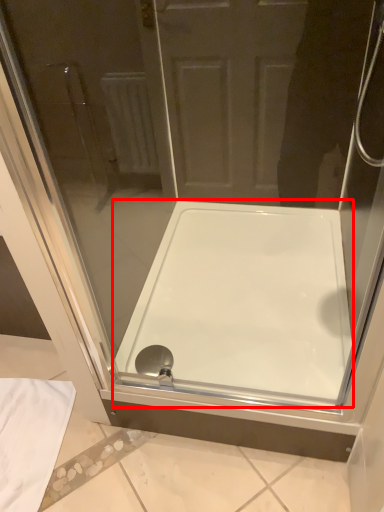
Question: In this image, where is bathtub (annotated by the red box) located relative to shower?

Choices:
 (A) left
 (B) right

Answer: (B)